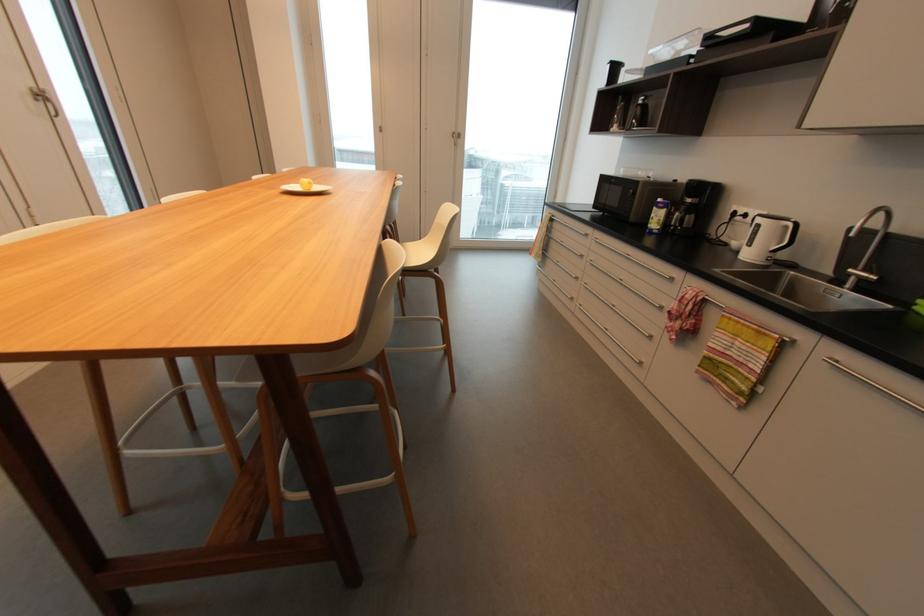
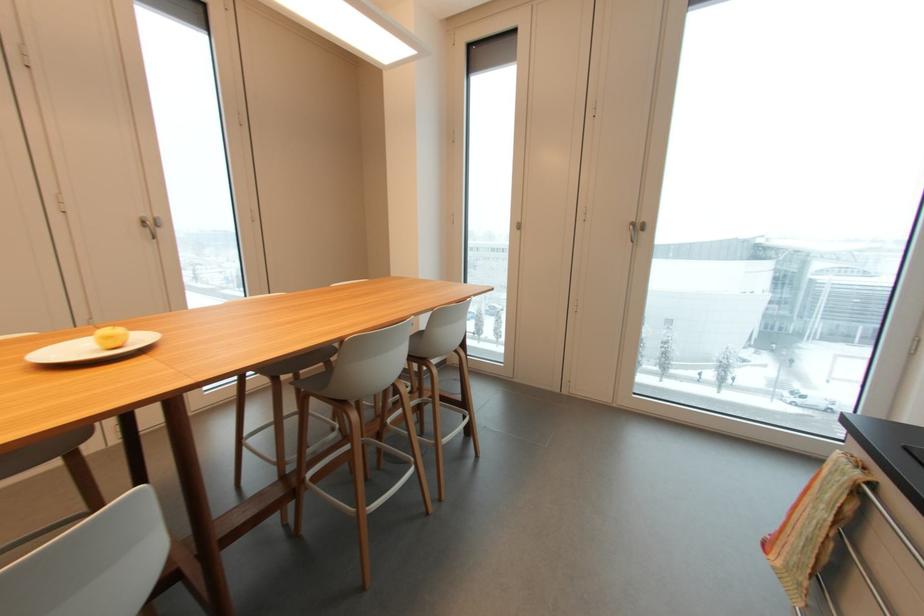
In the second image, find the point that corresponds to [463,140] in the first image.

(643, 233)